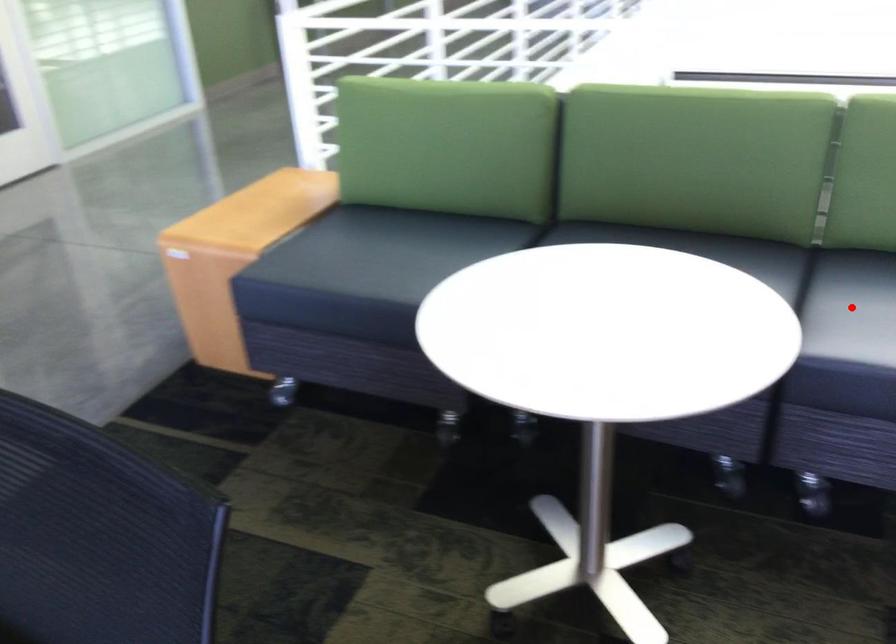
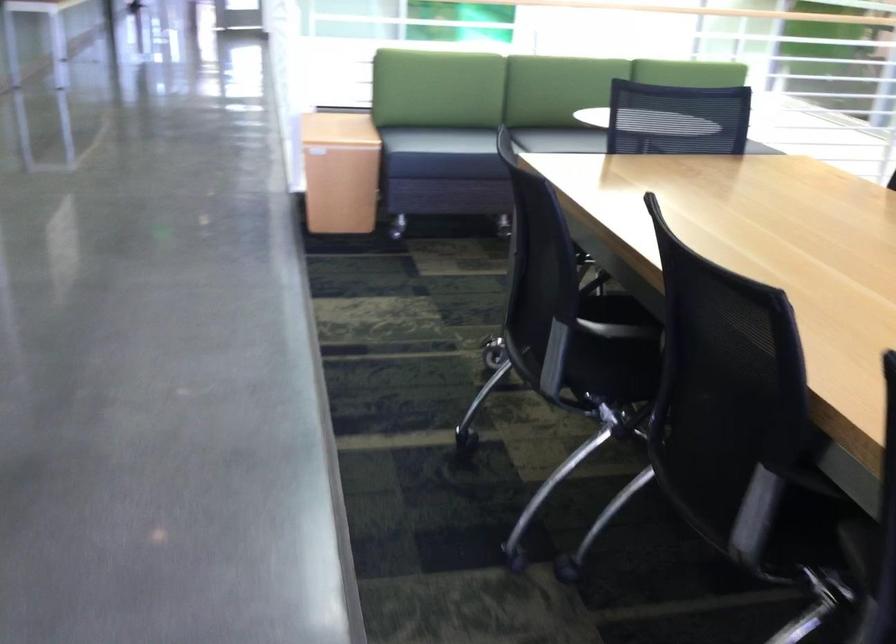
Question: I am providing you with two images of the same scene from different viewpoints. A red point is marked on the first image. At the location where the point appears in image 1, is it still visible in image 2?

Choices:
 (A) Yes
 (B) No

Answer: (B)